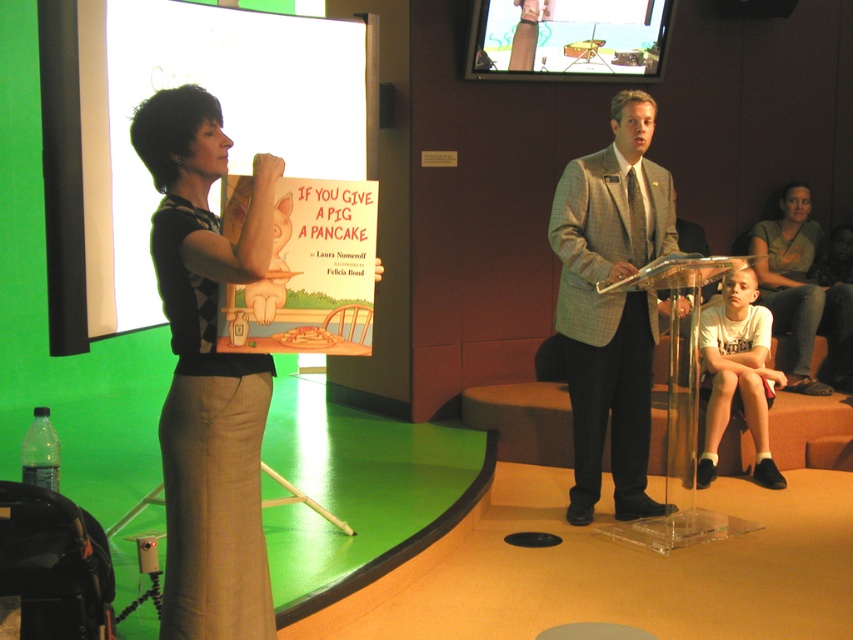
Question: Which point is farther from the camera taking this photo?

Choices:
 (A) (640, 104)
 (B) (167, 410)
 (C) (801, 212)
 (D) (503, 61)

Answer: (C)

Question: Can you confirm if gray checkered suit at center is smaller than matte green shirt at upper right?

Choices:
 (A) yes
 (B) no

Answer: (B)

Question: Is white paper at upper left closer to camera compared to gray checkered suit at center?

Choices:
 (A) yes
 (B) no

Answer: (A)

Question: Which point is closer to the camera?

Choices:
 (A) white paper at upper left
 (B) matte plastic tv at upper center
 (C) beige textured skirt at left

Answer: (C)

Question: Which point is closer to the camera?

Choices:
 (A) matte plastic tv at upper center
 (B) matte green shirt at upper right
 (C) beige textured skirt at left

Answer: (C)

Question: Is white paper at upper left bigger than matte plastic tv at upper center?

Choices:
 (A) no
 (B) yes

Answer: (B)